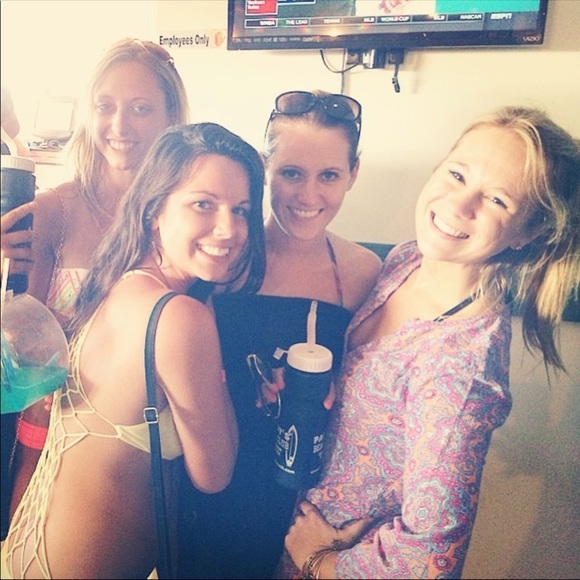
Where is `wall`? The image size is (580, 580). wall is located at coordinates (427, 119).